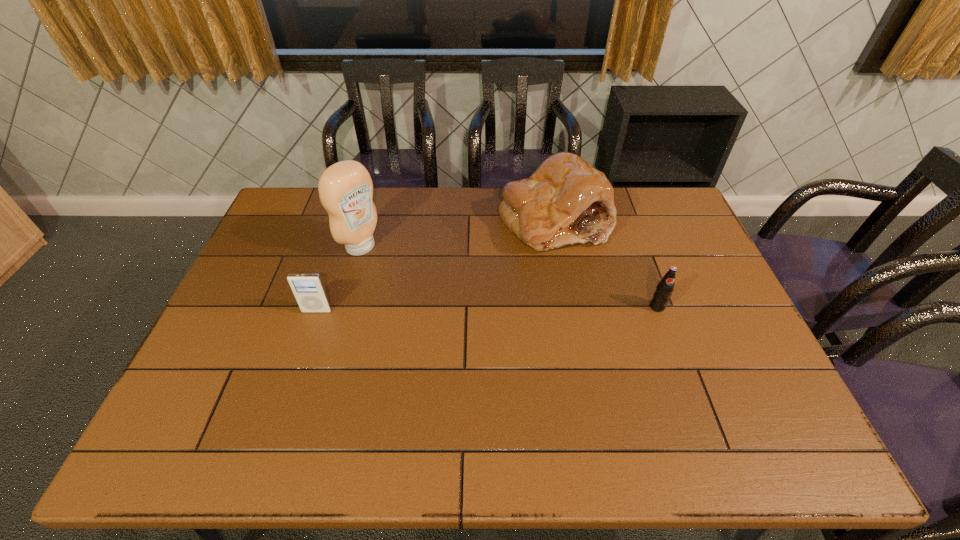
Where is `free spot located on the filling side of the second tallest object`? This screenshot has width=960, height=540. free spot located on the filling side of the second tallest object is located at coordinates (541, 278).

I want to click on vacant region located on the filling side of the second tallest object, so click(x=532, y=323).

Where is `vacant space situated 0.190m on the filling side of the second tallest object`? This screenshot has width=960, height=540. vacant space situated 0.190m on the filling side of the second tallest object is located at coordinates (537, 302).

Locate an element on the screen. object that is at the far edge is located at coordinates (566, 201).

I want to click on blank space at the far edge of the desktop, so click(x=393, y=227).

In the image, there is a desktop. Where is `free space at the near edge`? free space at the near edge is located at coordinates (x=385, y=397).

This screenshot has width=960, height=540. I want to click on free space at the left edge, so click(x=275, y=327).

Locate an element on the screen. vacant space at the right edge of the desktop is located at coordinates (688, 323).

In the image, there is a desktop. In order to click on free region at the near left corner in this screenshot , I will do `click(204, 401)`.

Find the location of `free point at the near right corner`. free point at the near right corner is located at coordinates (779, 404).